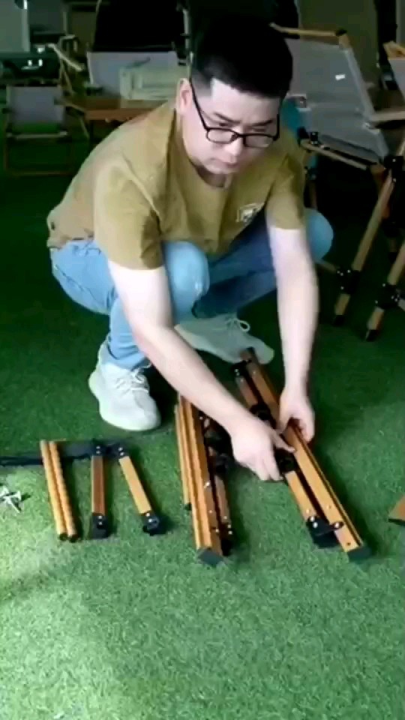
The image size is (405, 720). In order to click on printer in this screenshot , I will do `click(170, 76)`.